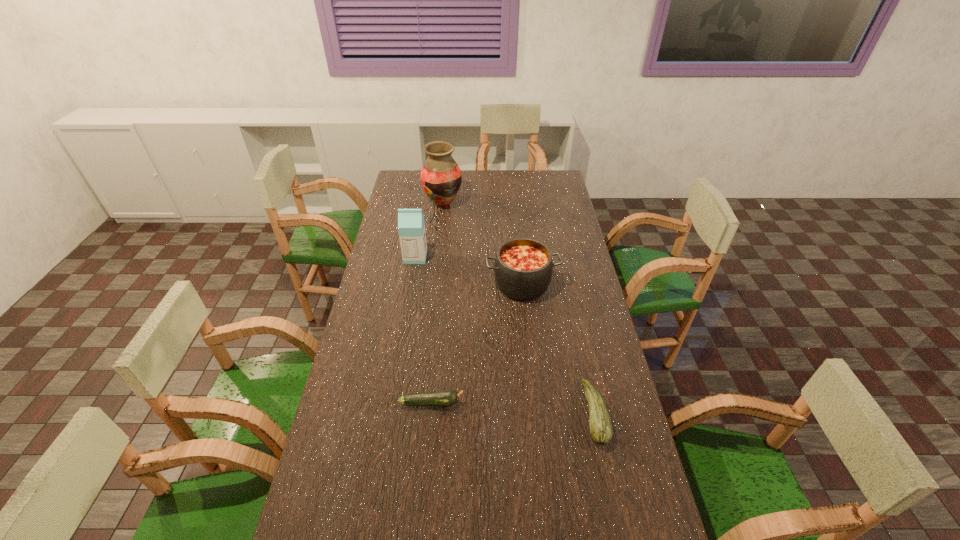
I want to click on the farthest object, so click(x=441, y=177).

Find the location of a particular element. This screenshot has height=540, width=960. vase is located at coordinates (441, 177).

Locate an element on the screen. This screenshot has height=540, width=960. the fourth nearest object is located at coordinates (411, 227).

Where is `the second tallest object`? The height and width of the screenshot is (540, 960). the second tallest object is located at coordinates (411, 227).

Identify the location of casserole. The height and width of the screenshot is (540, 960). (523, 268).

You are a GUI agent. You are given a task and a screenshot of the screen. Output one action in this format:
    pyautogui.click(x=<x>, y=<y>)
    Task: Click on the third shortest object
    The height and width of the screenshot is (540, 960).
    Given the screenshot: What is the action you would take?
    pyautogui.click(x=523, y=268)

This screenshot has width=960, height=540. I want to click on the second shortest object, so click(x=601, y=431).

This screenshot has height=540, width=960. Identify the location of the taller zucchini. [x=601, y=431].

Locate an element on the screen. The image size is (960, 540). the shorter zucchini is located at coordinates (447, 397).

Find the location of a particular element. the shortest object is located at coordinates (447, 397).